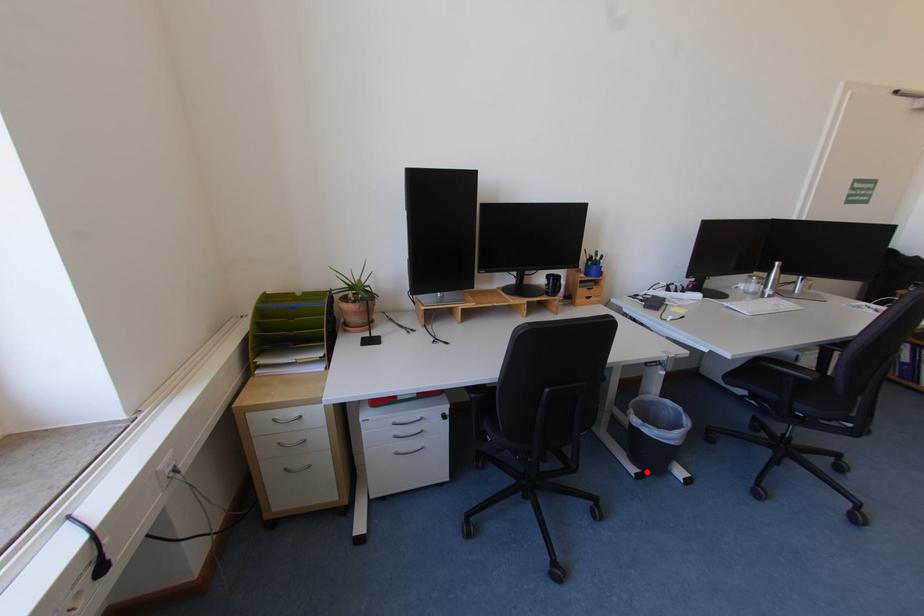
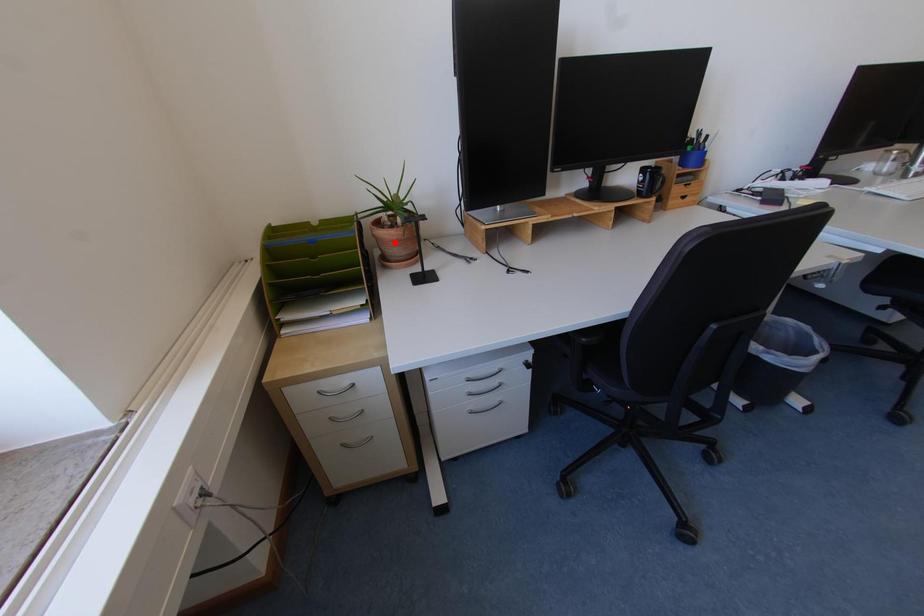
I am providing you with two images of the same scene from different viewpoints. A red point is marked on the first image and another point is marked on the second image. Does the point marked in image1 correspond to the same location as the one in image2?

No